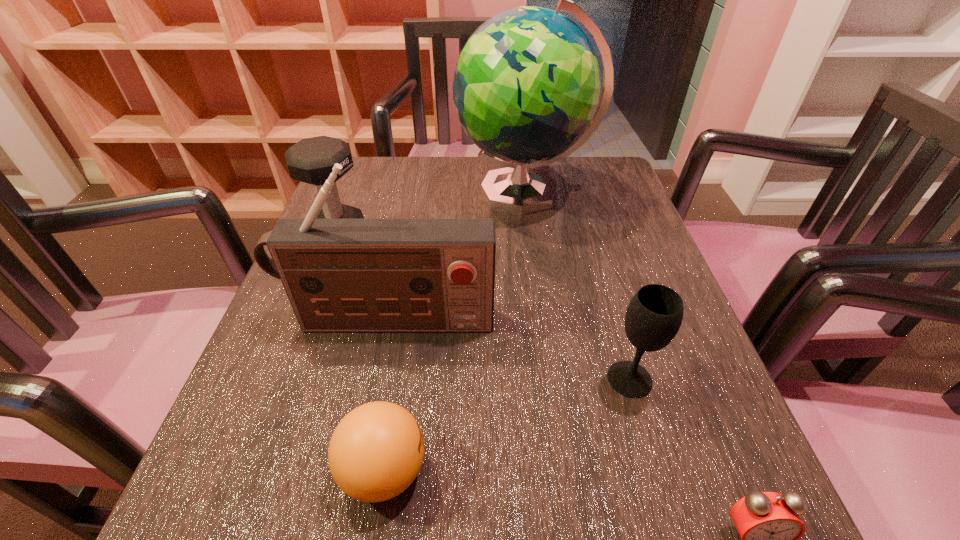
This screenshot has width=960, height=540. What are the coordinates of `the tallest object` in the screenshot? It's located at coord(526,86).

Locate an element on the screen. This screenshot has height=540, width=960. radio receiver is located at coordinates click(340, 275).

In order to click on the third farthest object in this screenshot , I will do `click(340, 275)`.

You are a GUI agent. You are given a task and a screenshot of the screen. Output one action in this format:
    pyautogui.click(x=<x>, y=<y>)
    Task: Click on the dumbbell
    Image resolution: width=960 pixels, height=540 pixels.
    Given the screenshot: What is the action you would take?
    pyautogui.click(x=311, y=160)

Identify the location of the fourth farthest object. This screenshot has height=540, width=960. (654, 315).

This screenshot has height=540, width=960. What are the coordinates of `the fourth tallest object` in the screenshot? It's located at (654, 315).

Image resolution: width=960 pixels, height=540 pixels. I want to click on the second shortest object, so click(376, 451).

Where is `free space located 0.240m on the front surface of the globe`? This screenshot has height=540, width=960. free space located 0.240m on the front surface of the globe is located at coordinates (361, 193).

Where is `free space located 0.120m on the front surface of the globe`? free space located 0.120m on the front surface of the globe is located at coordinates (x=409, y=193).

I want to click on free location located 0.100m on the front surface of the globe, so click(x=417, y=193).